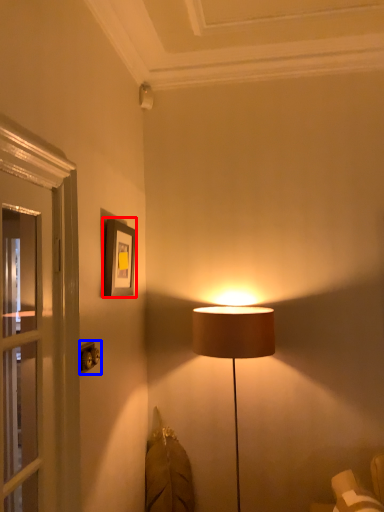
Question: Which object is closer to the camera taking this photo, picture frame (highlighted by a red box) or electric outlet (highlighted by a blue box)?

Choices:
 (A) picture frame
 (B) electric outlet

Answer: (B)